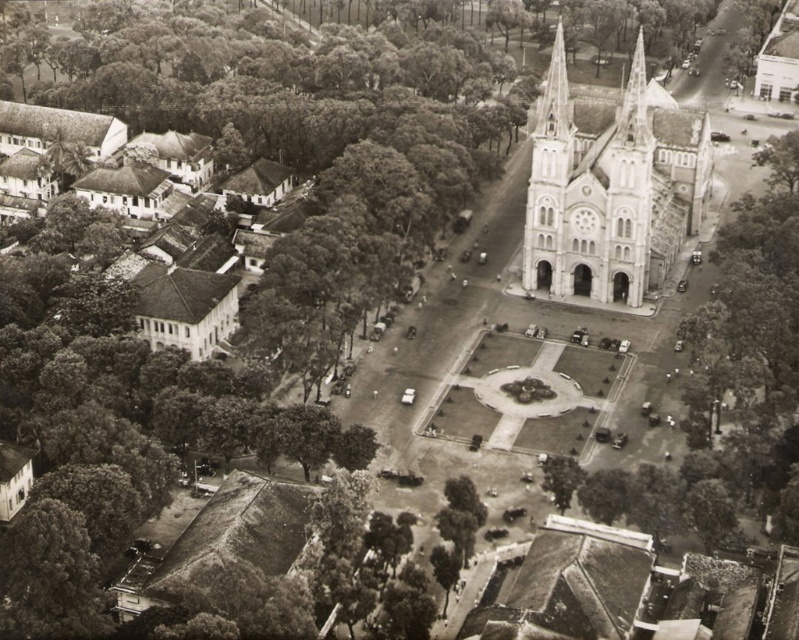
From the picture: You are a tourist standing at the edge of the plaza, looking towards the stone church at center. Can you see the green leafy tree at center from your position?

The green leafy tree at center is behind the stone church at center, so it is obstructed from view by the church. Therefore, you cannot see the green leafy tree at center from your position at the edge of the plaza.

You are a tourist standing at the edge of the square, looking towards the stone church at center. Can you see the dark green leafy tree at lower left from your position?

The dark green leafy tree at lower left is behind the stone church at center, so it would be obstructed from view when standing at the edge of the square facing the church.